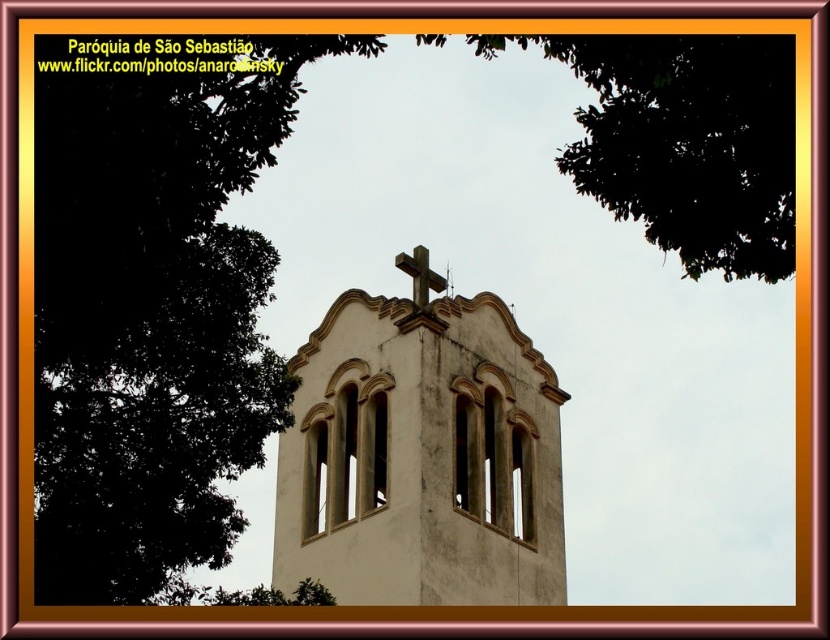
Question: Which object appears closest to the camera in this image?

Choices:
 (A) rustic wooden cross at center
 (B) white textured tower at center

Answer: (B)

Question: Among these points, which one is farthest from the camera?

Choices:
 (A) (382, 424)
 (B) (408, 260)

Answer: (B)

Question: Is white textured tower at center thinner than rustic wooden cross at center?

Choices:
 (A) yes
 (B) no

Answer: (B)

Question: From the image, what is the correct spatial relationship of white textured tower at center in relation to rustic wooden cross at center?

Choices:
 (A) right
 (B) left

Answer: (B)

Question: Which object appears farthest from the camera in this image?

Choices:
 (A) rustic wooden cross at center
 (B) white textured tower at center

Answer: (A)

Question: Can you confirm if white textured tower at center is thinner than rustic wooden cross at center?

Choices:
 (A) no
 (B) yes

Answer: (A)